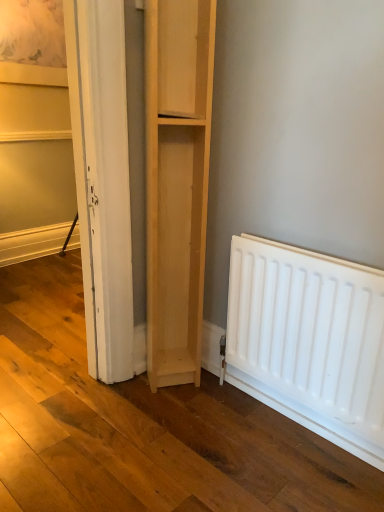
At what (x,y) coordinates should I click in order to perform the action: click on natural wood cupboard at center. Please return your answer as a coordinate pair (x, y). The image size is (384, 512). Looking at the image, I should click on (177, 182).

The width and height of the screenshot is (384, 512). What do you see at coordinates (177, 182) in the screenshot?
I see `natural wood cupboard at center` at bounding box center [177, 182].

This screenshot has width=384, height=512. Identify the location of natural wood cupboard at center. (177, 182).